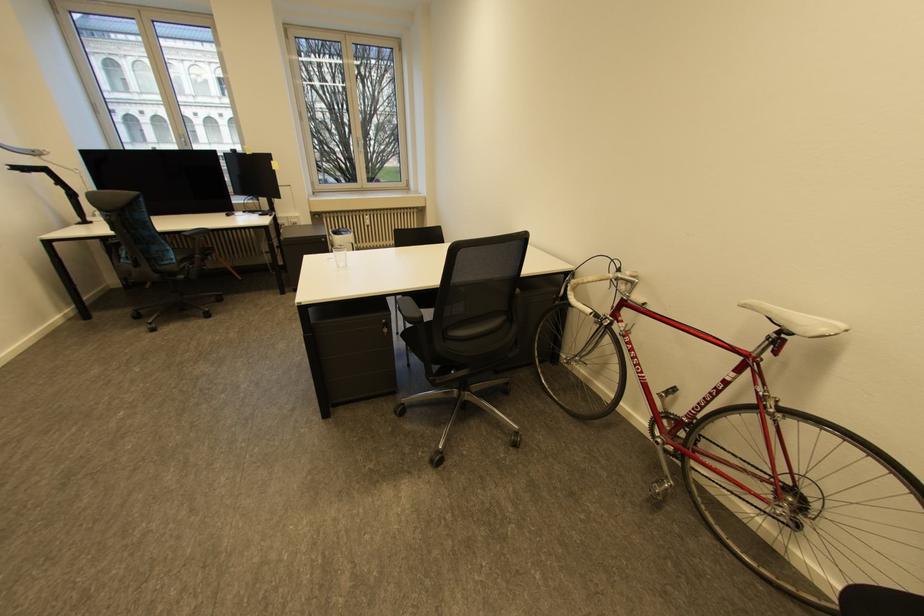
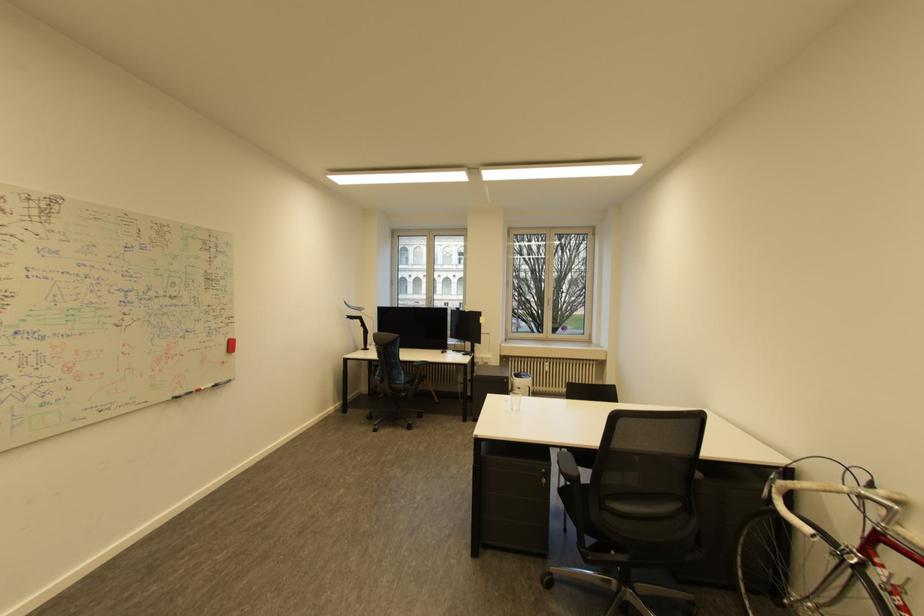
The point at (626,276) is marked in the first image. Where is the corresponding point in the second image?

(869, 492)